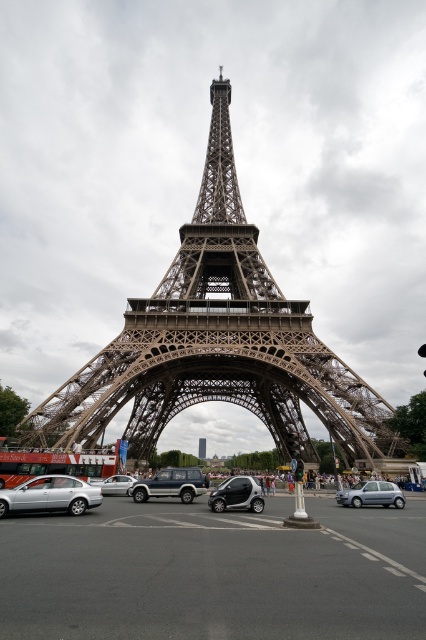
Question: Is metallic silver suv at center to the right of shiny silver car at center from the viewer's perspective?

Choices:
 (A) no
 (B) yes

Answer: (A)

Question: Does red metallic bus at lower left have a smaller size compared to shiny silver car at center?

Choices:
 (A) yes
 (B) no

Answer: (B)

Question: Which point is closer to the camera?

Choices:
 (A) (126, 486)
 (B) (368, 483)

Answer: (B)

Question: Which point is closer to the camera?

Choices:
 (A) silver metallic car at lower left
 (B) metallic silver suv at center
 (C) silver metallic hatchback at lower center
 (D) brown metal eiffel tower at center

Answer: (A)

Question: Which point is farther from the camera taking this photo?

Choices:
 (A) pos(195,472)
 (B) pos(51,465)
 (C) pos(236,499)

Answer: (A)

Question: Can you confirm if red metallic bus at lower left is smaller than silver metallic car at center?

Choices:
 (A) no
 (B) yes

Answer: (A)